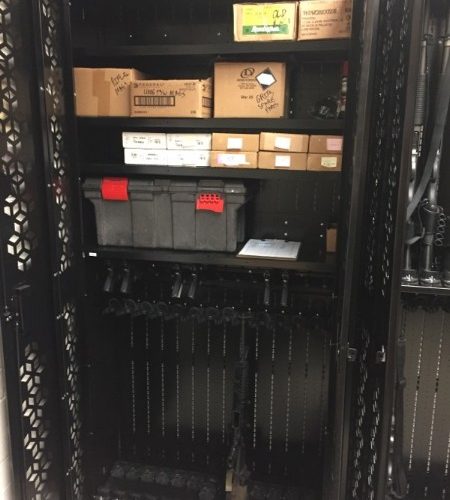
Find the location of a particular element. This screenshot has height=500, width=450. clipboard is located at coordinates (278, 255).